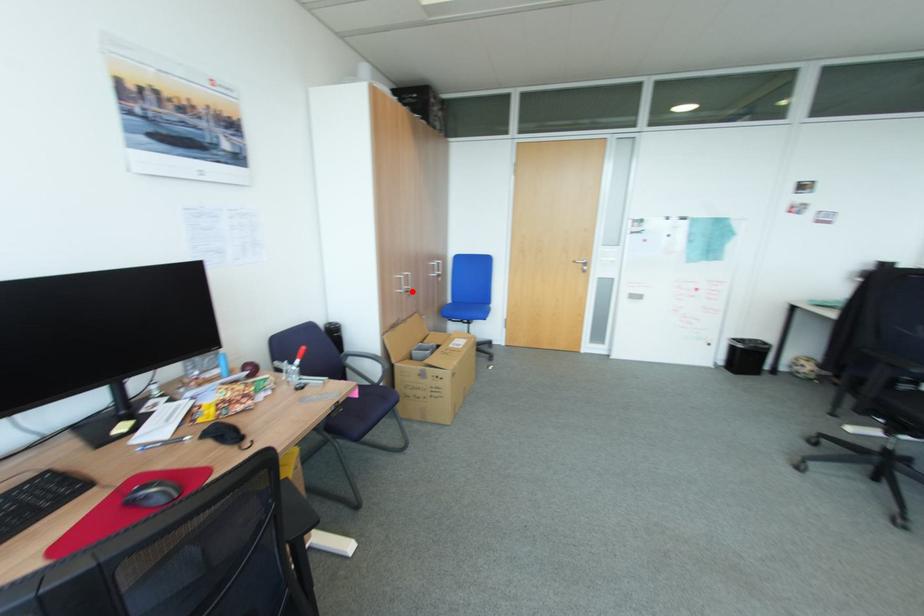
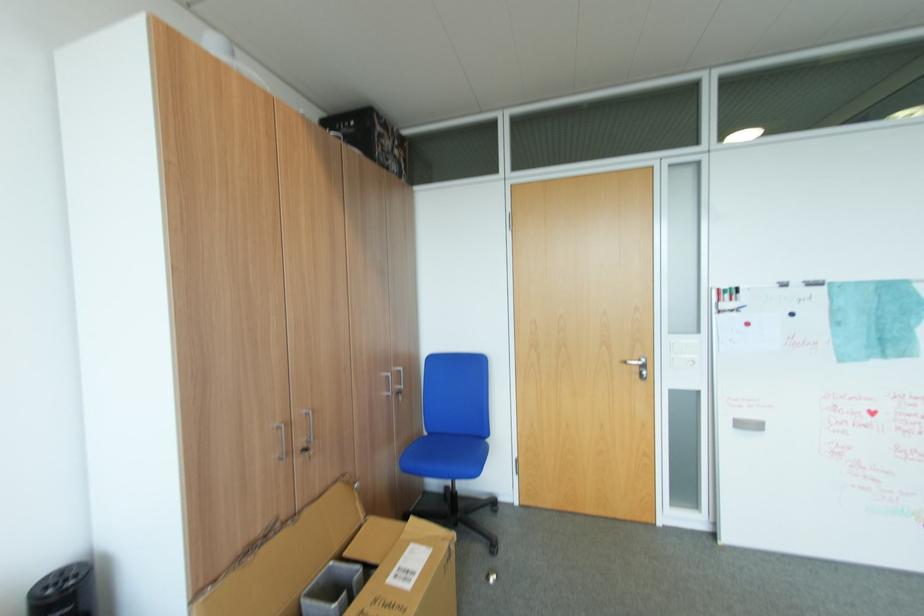
Where in the second image is the point corresponding to the highlighted location from the first image?

(310, 451)